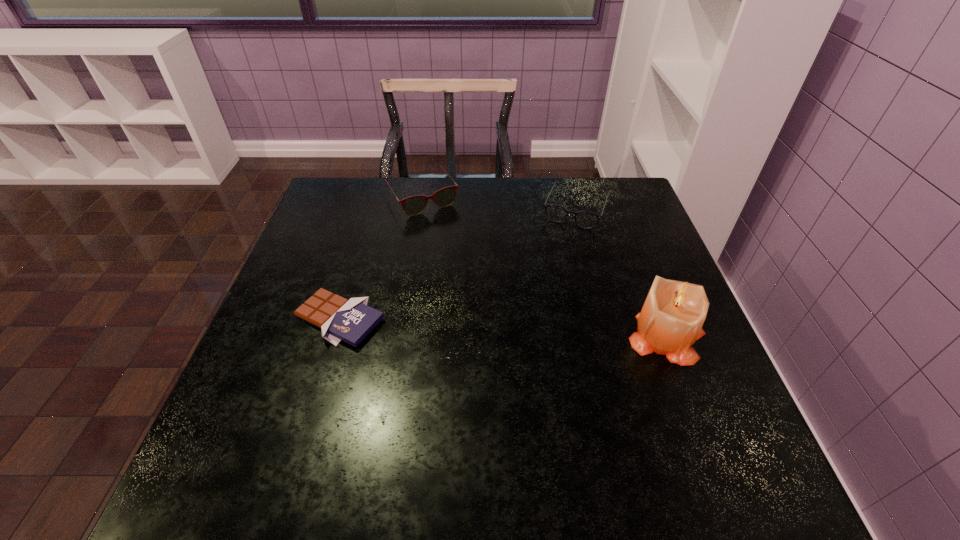
Where is `blank space located 0.080m at the front view of the left spectacles`? blank space located 0.080m at the front view of the left spectacles is located at coordinates (447, 232).

You are a GUI agent. You are given a task and a screenshot of the screen. Output one action in this format:
    pyautogui.click(x=<x>, y=<y>)
    Task: Click on the vacant space located at the front view of the left spectacles
    The image size is (960, 540).
    Given the screenshot: What is the action you would take?
    pyautogui.click(x=446, y=231)

The image size is (960, 540). In order to click on object at the left edge in this screenshot , I will do `click(351, 320)`.

Where is `candle situated at the right edge`? candle situated at the right edge is located at coordinates (671, 319).

The image size is (960, 540). In order to click on spectacles located in the right edge section of the desktop in this screenshot , I will do `click(584, 219)`.

What are the coordinates of `object that is at the far right corner` in the screenshot? It's located at (584, 219).

Identify the location of vacant space at the far edge. This screenshot has height=540, width=960. (376, 217).

This screenshot has height=540, width=960. Find the location of `free space at the near edge of the desktop`. free space at the near edge of the desktop is located at coordinates (597, 425).

This screenshot has height=540, width=960. In order to click on blank space at the left edge in this screenshot , I will do `click(355, 232)`.

The width and height of the screenshot is (960, 540). In order to click on free region at the right edge of the desktop in this screenshot , I will do `click(682, 369)`.